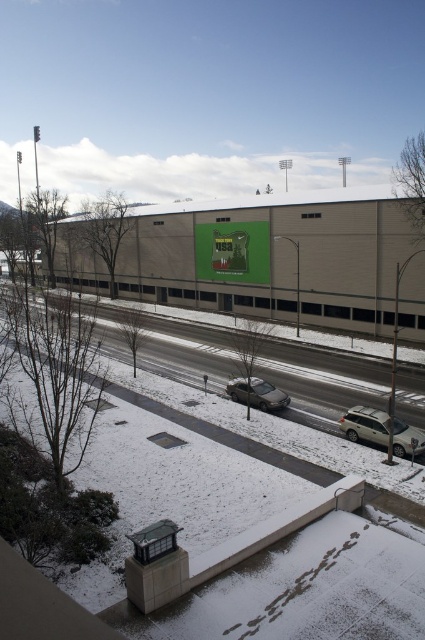
Is point (382, 435) positioned behind point (241, 392)?

That is False.

Does satin silver suv at lower right have a smaller size compared to satin silver sedan at center?

Indeed, satin silver suv at lower right has a smaller size compared to satin silver sedan at center.

Where is `satin silver suv at lower right`? satin silver suv at lower right is located at coordinates (365, 426).

Which is more to the right, snow-covered asphalt highway at lower center or satin silver sedan at center?

satin silver sedan at center

Consider the image. Can you confirm if snow-covered asphalt highway at lower center is positioned to the left of satin silver sedan at center?

Indeed, snow-covered asphalt highway at lower center is positioned on the left side of satin silver sedan at center.

Which is behind, point (342, 392) or point (283, 406)?

Positioned behind is point (342, 392).

The height and width of the screenshot is (640, 425). I want to click on snow-covered asphalt highway at lower center, so click(331, 394).

Does snow-covered asphalt highway at lower center appear over satin silver suv at lower right?

Yes.

Which is below, snow-covered asphalt highway at lower center or satin silver suv at lower right?

satin silver suv at lower right is below.

Does point (73, 298) come in front of point (368, 435)?

That is False.

Locate an element on the screen. Image resolution: width=425 pixels, height=640 pixels. snow-covered asphalt highway at lower center is located at coordinates (331, 394).